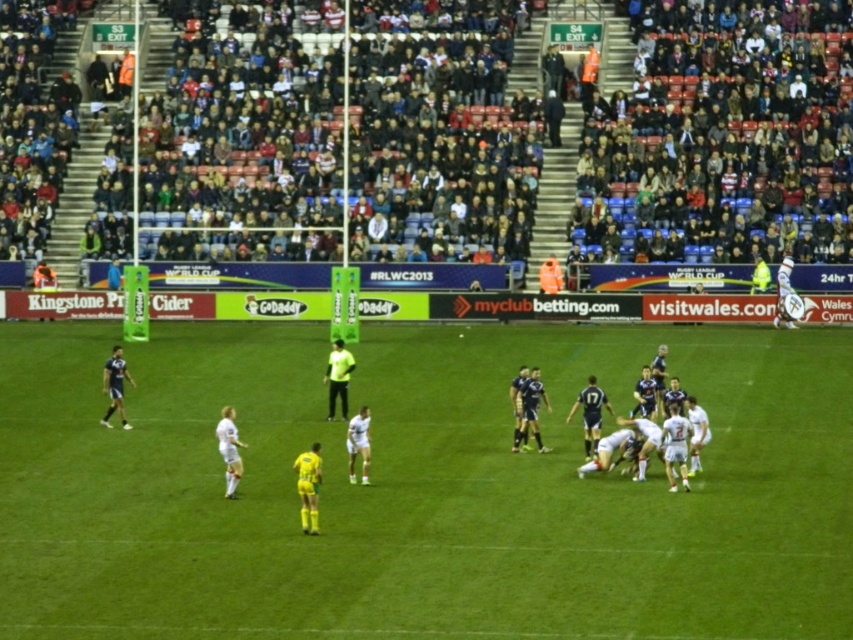
You are a photographer positioned at the center of the stadium, aiming to capture a photo that includes both the point at point (30, 403) and the point at point (141, 250). Considering their positions, which point should you focus on first to ensure both are in sharp focus?

You should focus on point (30, 403) first because it is closer to the camera than point (141, 250), ensuring both points fall within the depth of field when focused on the closer point.

You are a photographer at the rugby match and want to capture a photo of both the blue jersey at center and the neon yellow shirt at center. Which one should you focus on first to ensure both are in the frame?

The blue jersey at center is below the neon yellow shirt at center, so you should focus on the neon yellow shirt at center first to ensure both are in the frame.

You are a photographer at the rugby match. You want to take a photo where the green grass field at center is the main focus. Would the neon yellow shirt at center be visible in the foreground or background of this photo?

The green grass field at center is much taller than the neon yellow shirt at center, so the neon yellow shirt at center would be in the foreground of the photo.